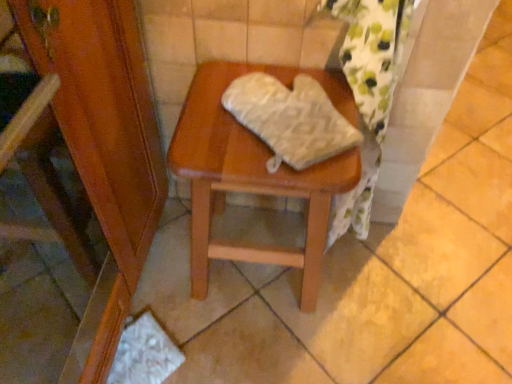
The width and height of the screenshot is (512, 384). In order to click on vacant space underneath wooden stool at center (from a real-world perspective) in this screenshot , I will do `click(251, 278)`.